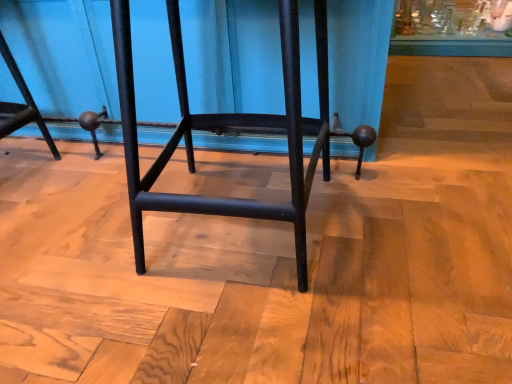
Locate an element on the screen. Image resolution: width=512 pixels, height=384 pixels. free location to the left of black matte metal chair at center is located at coordinates (72, 228).